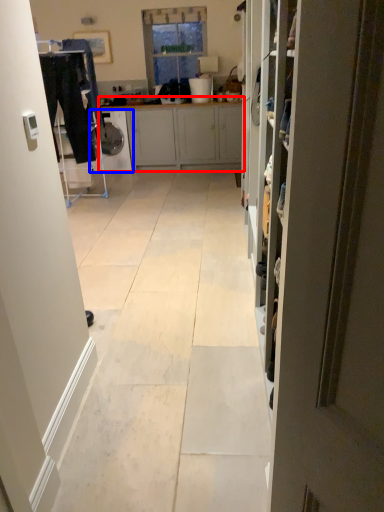
Question: Which object is further to the camera taking this photo, cabinetry (highlighted by a red box) or dish washer (highlighted by a blue box)?

Choices:
 (A) cabinetry
 (B) dish washer

Answer: (B)